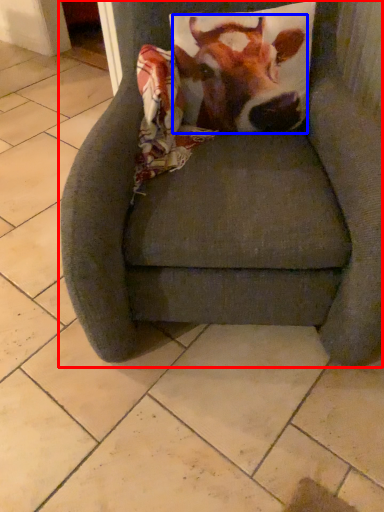
Question: Which object is further to the camera taking this photo, chair (highlighted by a red box) or cattle (highlighted by a blue box)?

Choices:
 (A) chair
 (B) cattle

Answer: (B)